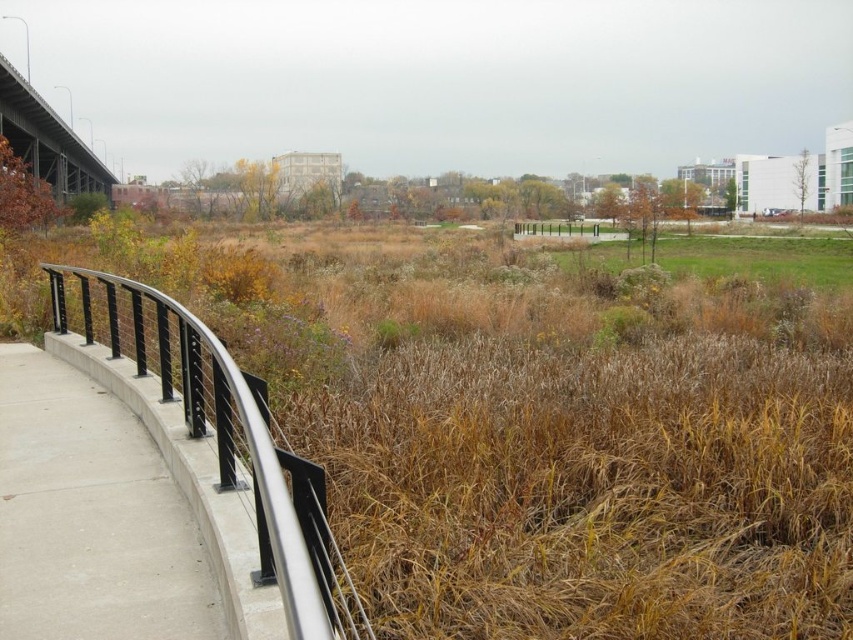
You are a gardener standing on the concrete at left and want to reach the brown dry grass at center. Which direction should you move to get there?

The brown dry grass at center is above the concrete at left, so you should move upward to reach it.

Looking at this image, you are a gardener who needs to mow the lawn. You see brown dry grass at center and concrete at left. Which area requires mowing?

The brown dry grass at center requires mowing because it has a greater height compared to the concrete at left, which is a hard surface and does not need mowing.

You are standing on the concrete at left and want to walk towards the brown dry grass at center. Which direction should you move in?

You should move to the right because the brown dry grass at center is to the right of concrete at left.